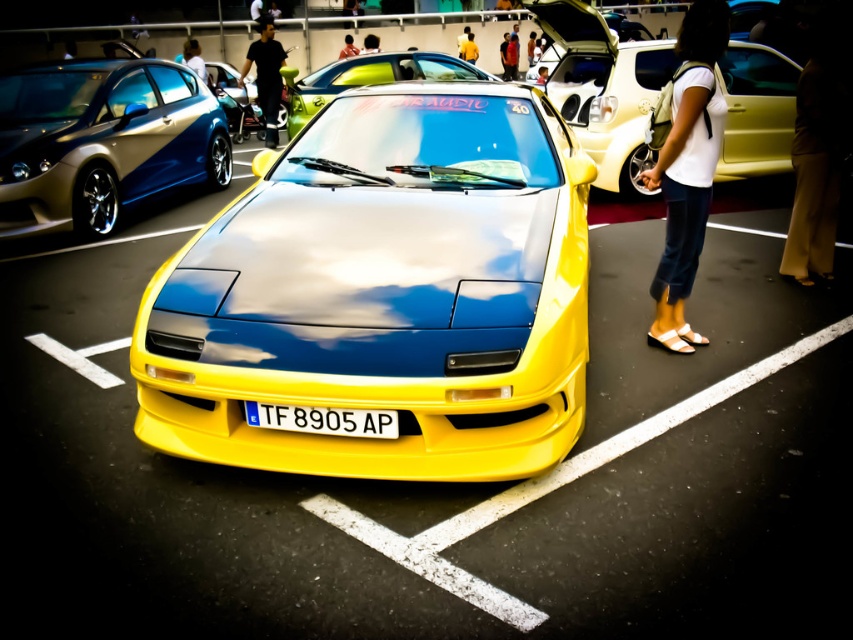
You are standing at the car show and want to walk from the point marked as point (18, 140) to the point marked as point (474, 54). Which direction should you move to get there?

To move from point (18, 140) to point (474, 54), you should move backward since point (18, 140) is in front of point (474, 54).